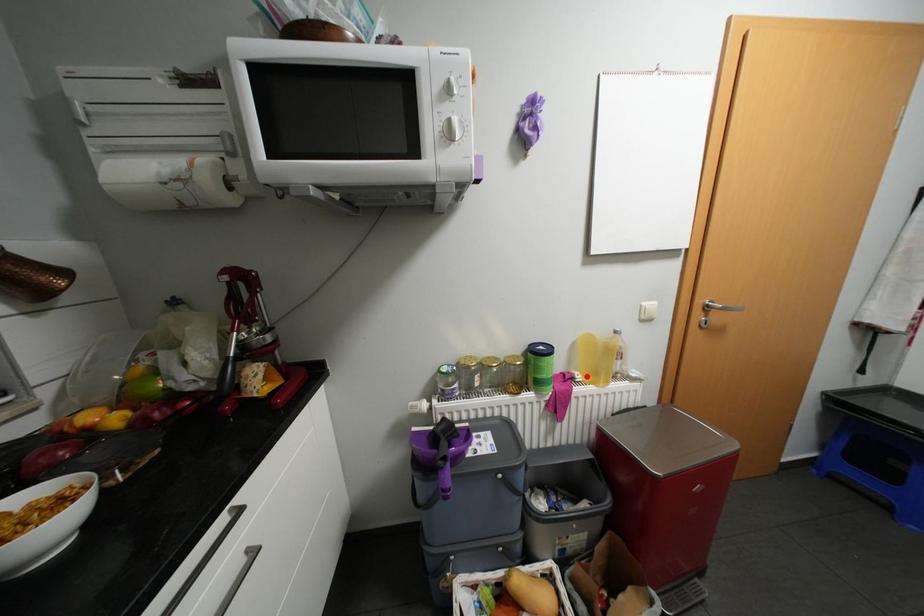
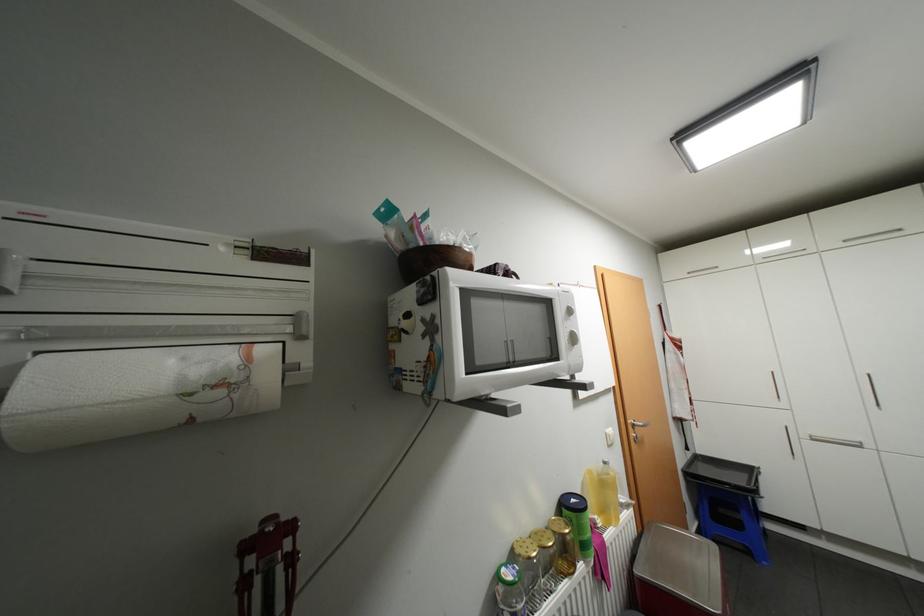
In the second image, find the point that corresponds to the highlighted location in the first image.

(606, 521)